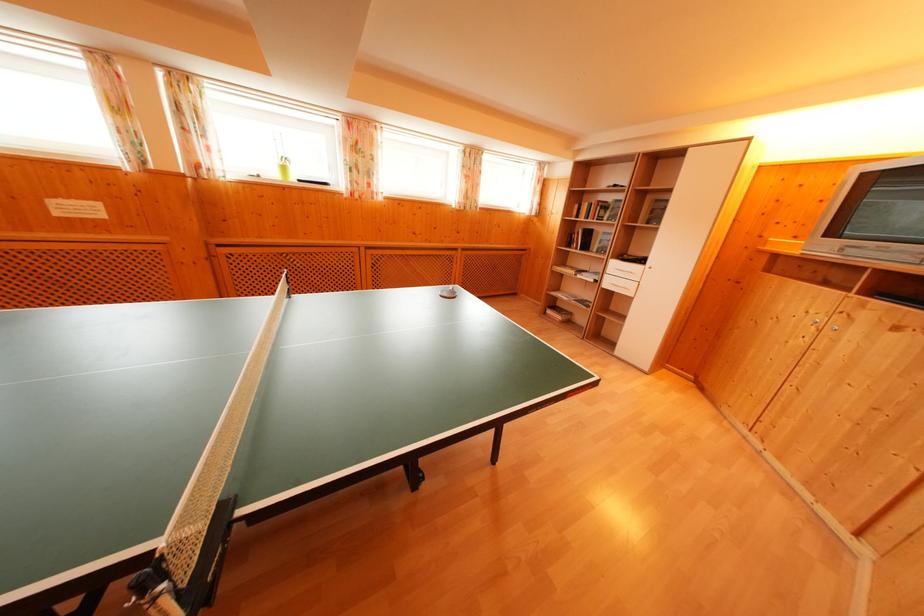
Find the location of `ping pong paddle`. ping pong paddle is located at coordinates (447, 292).